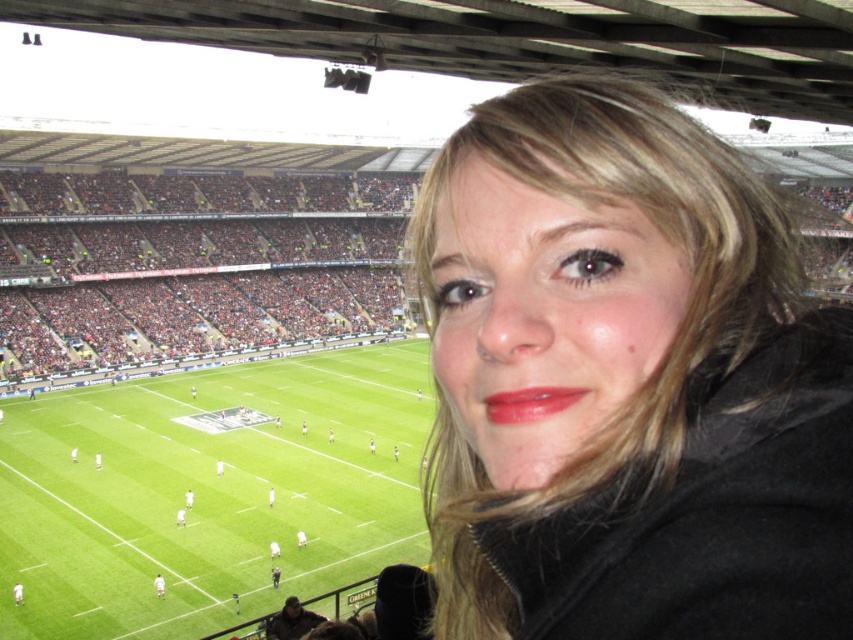
Between point (247, 557) and point (566, 388), which one is positioned in front?

Point (566, 388)

Identify the location of green grass football field at center. Image resolution: width=853 pixels, height=640 pixels. 207,493.

Does black matte jacket at right have a greater width compared to shiny red lipstick at center?

Correct, the width of black matte jacket at right exceeds that of shiny red lipstick at center.

Does black matte jacket at right appear on the left side of shiny red lipstick at center?

In fact, black matte jacket at right is to the right of shiny red lipstick at center.

Which is behind, point (608, 429) or point (577, 387)?

Point (577, 387)

Locate an element on the screen. black matte jacket at right is located at coordinates (627, 381).

Is black matte jacket at right thinner than green grass football field at center?

Yes.

In the scene shown: Between black matte jacket at right and green grass football field at center, which one has more height?

Standing taller between the two is green grass football field at center.

Which is behind, point (671, 346) or point (148, 390)?

The point (148, 390) is more distant.

I want to click on black matte jacket at right, so click(x=627, y=381).